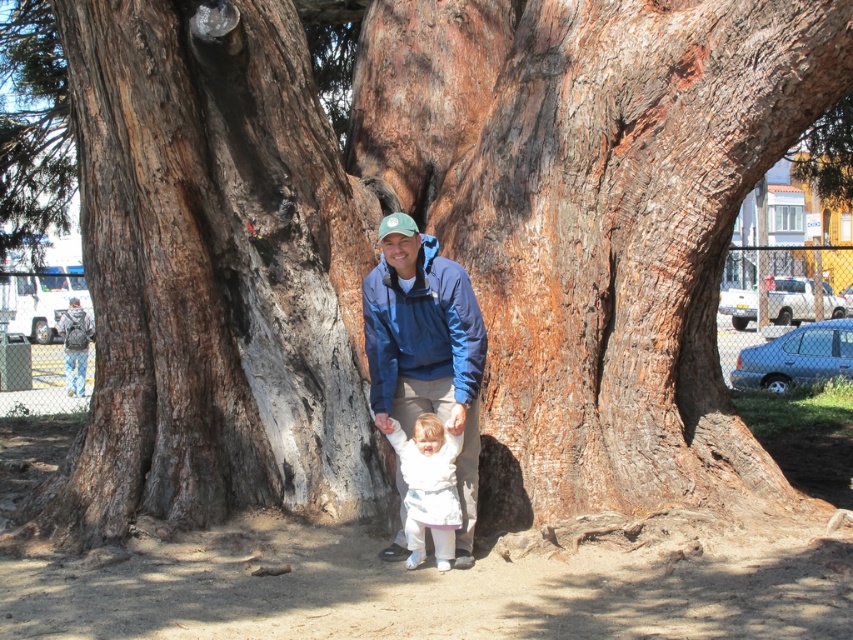
You are a photographer trying to capture a photo of the dark brown rough bark at center and the blue fabric jacket at center. Based on their positions, which object should you focus on first to ensure both are in sharp focus?

The dark brown rough bark at center is above the blue fabric jacket at center, so focusing on the bark first will ensure both are in sharp focus as it is closer to the camera.

You are a photographer trying to capture a photo of the blue fabric jacket at center and the white soft baby at center. Since you want to ensure both are in focus, you need to know their relative sizes. Which one is bigger?

The blue fabric jacket at center has a larger size compared to the white soft baby at center, so the blue fabric jacket at center is bigger.

You are standing in front of the tree and want to touch the dark brown rough bark at center. However, there is a blue fabric jacket at center in the way. Can you reach the bark without moving the jacket?

The dark brown rough bark at center is further to the viewer than the blue fabric jacket at center, so you can reach it without moving the jacket because it is closer to you.